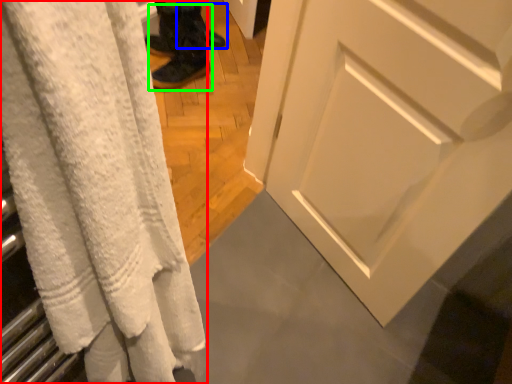
Question: Which object is positioned farthest from curtain (highlighted by a red box)? Select from footwear (highlighted by a blue box) and footwear (highlighted by a green box).

Choices:
 (A) footwear
 (B) footwear

Answer: (A)